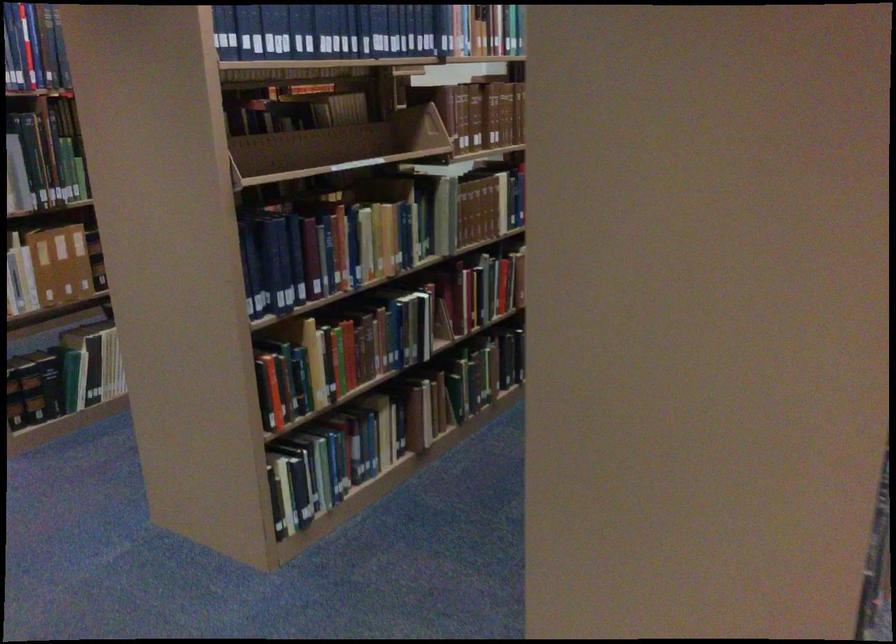
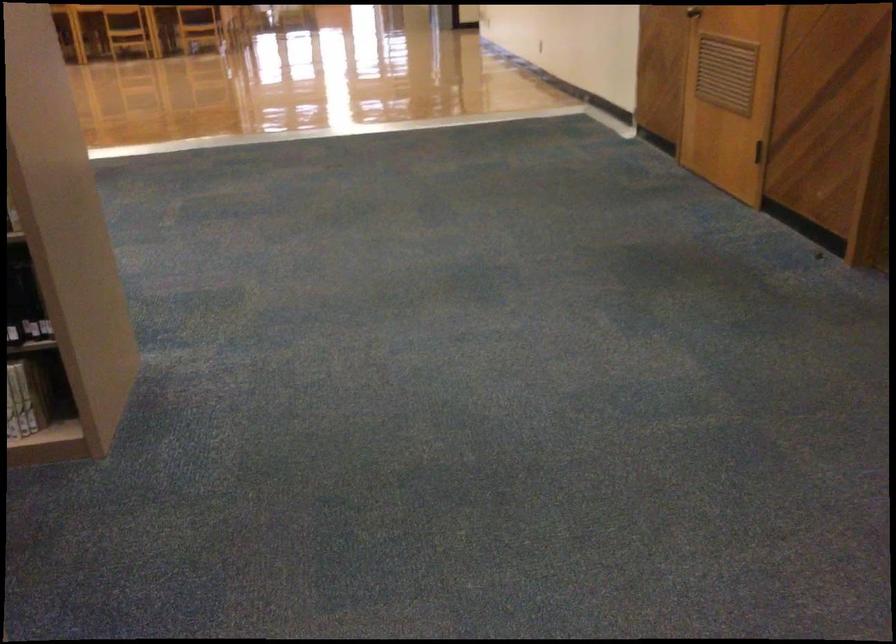
Find the pixel in the second image that matches the point at 599,475 in the first image.

(23, 299)